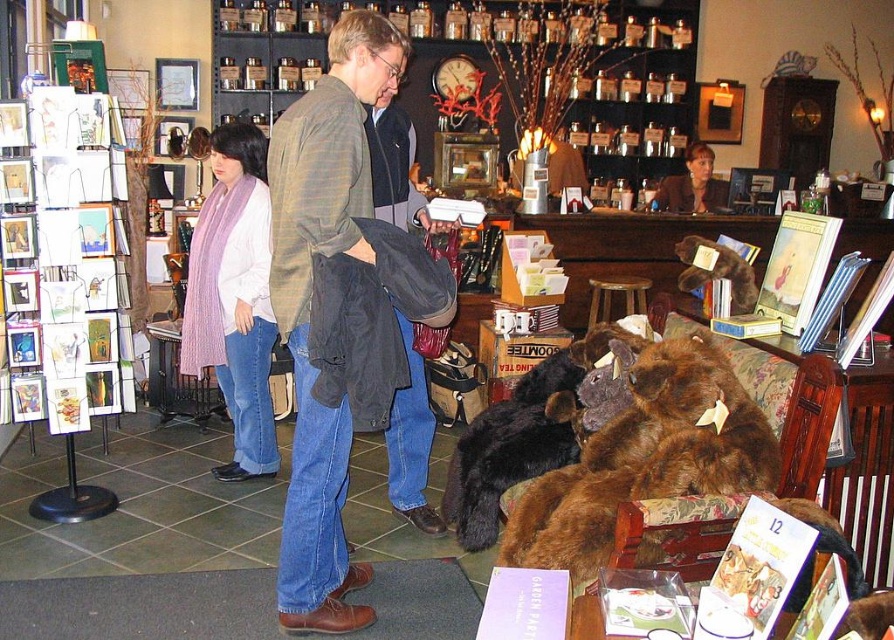
You are standing in the gift shop and want to reach the exit located at point (x=603, y=314). There is an obstacle at point (x=216, y=244). Can you walk straight from your current position to the exit without going around the obstacle?

Point (x=216, y=244) is in front of point (x=603, y=314), so you would need to go around the obstacle at point (x=216, y=244) to reach the exit at point (x=603, y=314).

You are a customer in the gift shop and want to find the purple striped scarf at left. According to the store layout, where should you look?

The purple striped scarf at left is located at the coordinates point (234, 298) in the store layout.

You are standing in the gift shop and want to reach both the point at coordinates (401, 33) and the point at coordinates (603, 292). Which point will you reach first?

You will reach the point at coordinates (401, 33) first because it is closer to you than the point at coordinates (603, 292).